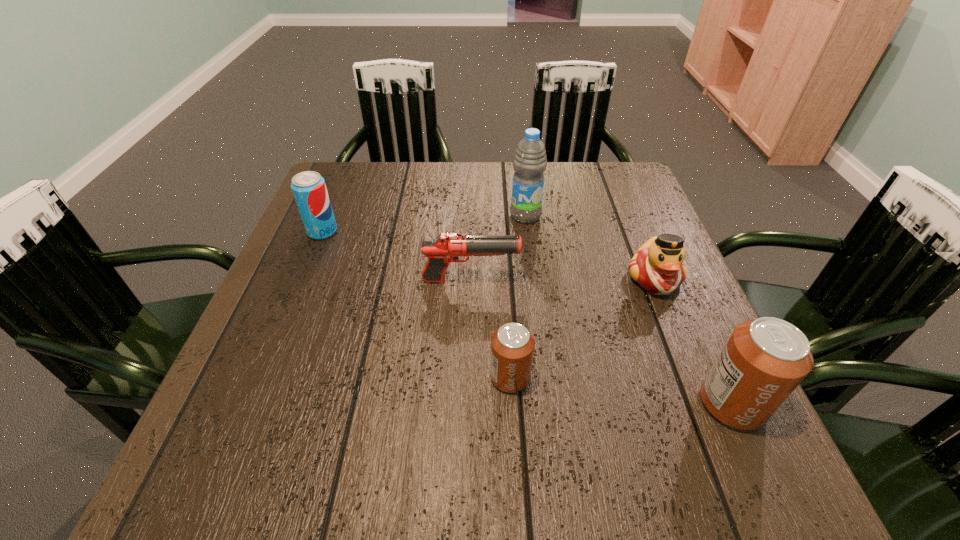
Locate an element on the screen. vacant region located on the left of the tallest object is located at coordinates (417, 215).

Identify the location of free space located 0.120m on the face of the duck. (683, 348).

What are the coordinates of `blank area located 0.160m at the aiming end of the gun` in the screenshot? It's located at (591, 281).

Where is `object that is at the far edge`? Image resolution: width=960 pixels, height=540 pixels. object that is at the far edge is located at coordinates (530, 160).

Locate an element on the screen. Image resolution: width=960 pixels, height=540 pixels. object located in the left edge section of the desktop is located at coordinates (309, 189).

The image size is (960, 540). I want to click on can at the right edge, so pyautogui.click(x=764, y=360).

At what (x,y) coordinates should I click in order to perform the action: click on duck at the right edge. Please return your answer as a coordinate pair (x, y). The height and width of the screenshot is (540, 960). Looking at the image, I should click on (657, 266).

Find the location of a particular element. This screenshot has height=540, width=960. object situated at the near right corner is located at coordinates (764, 360).

In the image, there is a desktop. Identify the location of vacant space at the far edge. The height and width of the screenshot is (540, 960). pyautogui.click(x=426, y=190).

In the image, there is a desktop. Identify the location of free space at the near edge. (354, 417).